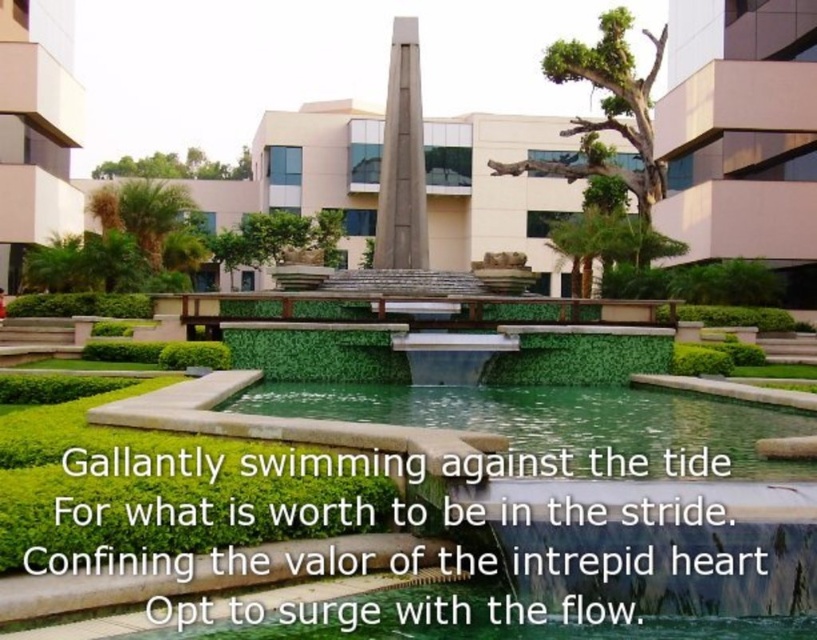
Question: Is green smooth water at center to the right of slate gray stone obelisk at center from the viewer's perspective?

Choices:
 (A) yes
 (B) no

Answer: (A)

Question: Among these points, which one is nearest to the camera?

Choices:
 (A) (389, 100)
 (B) (538, 436)

Answer: (B)

Question: Does green smooth water at center have a larger size compared to slate gray stone obelisk at center?

Choices:
 (A) no
 (B) yes

Answer: (A)

Question: Can you confirm if green smooth water at center is positioned above slate gray stone obelisk at center?

Choices:
 (A) no
 (B) yes

Answer: (A)